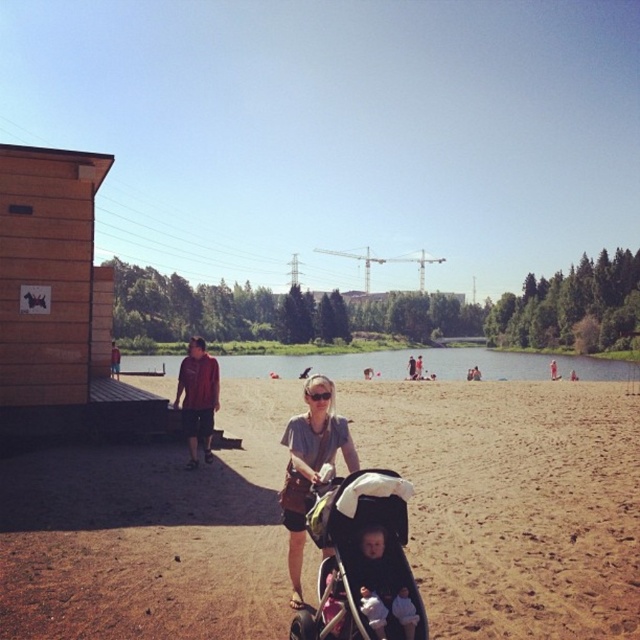
The image size is (640, 640). What do you see at coordinates (515, 502) in the screenshot?
I see `brown sand at center` at bounding box center [515, 502].

The height and width of the screenshot is (640, 640). Find the location of `brown sand at center`. brown sand at center is located at coordinates (515, 502).

Does green grassy lake at center have a greater height compared to light gray fabric baby at center?

Correct, green grassy lake at center is much taller as light gray fabric baby at center.

Can you confirm if green grassy lake at center is thinner than light gray fabric baby at center?

Incorrect, green grassy lake at center's width is not less than light gray fabric baby at center's.

Is point (586, 356) positioned in front of point (410, 637)?

That is False.

This screenshot has width=640, height=640. I want to click on green grassy lake at center, so click(428, 364).

Can you confirm if wooden hut at left is thinner than white cotton shirt at center?

Incorrect, wooden hut at left's width is not less than white cotton shirt at center's.

Consider the image. Does wooden hut at left appear under white cotton shirt at center?

Incorrect, wooden hut at left is not positioned below white cotton shirt at center.

This screenshot has width=640, height=640. Describe the element at coordinates (60, 307) in the screenshot. I see `wooden hut at left` at that location.

At what (x,y) coordinates should I click in order to perform the action: click on wooden hut at left. Please return your answer as a coordinate pair (x, y). Looking at the image, I should click on (60, 307).